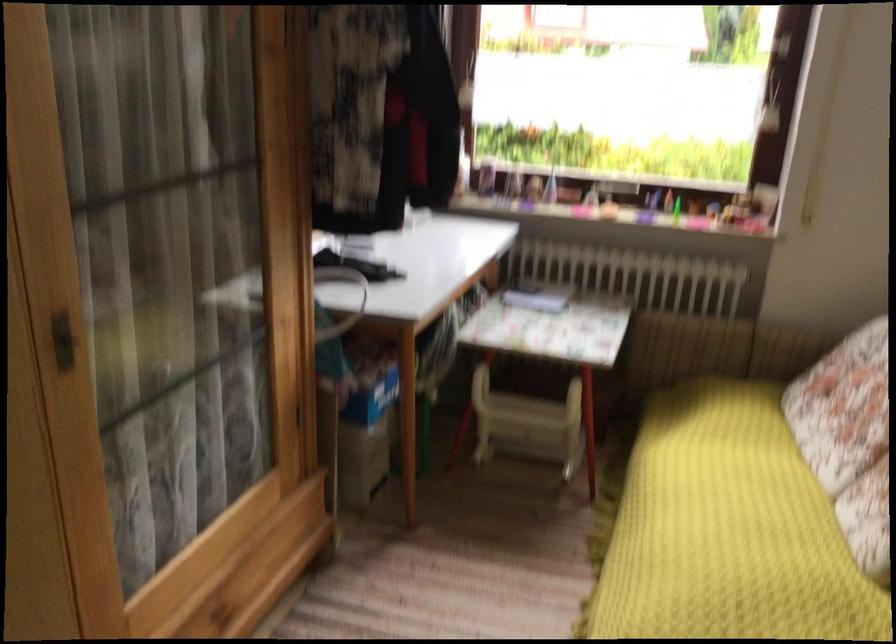
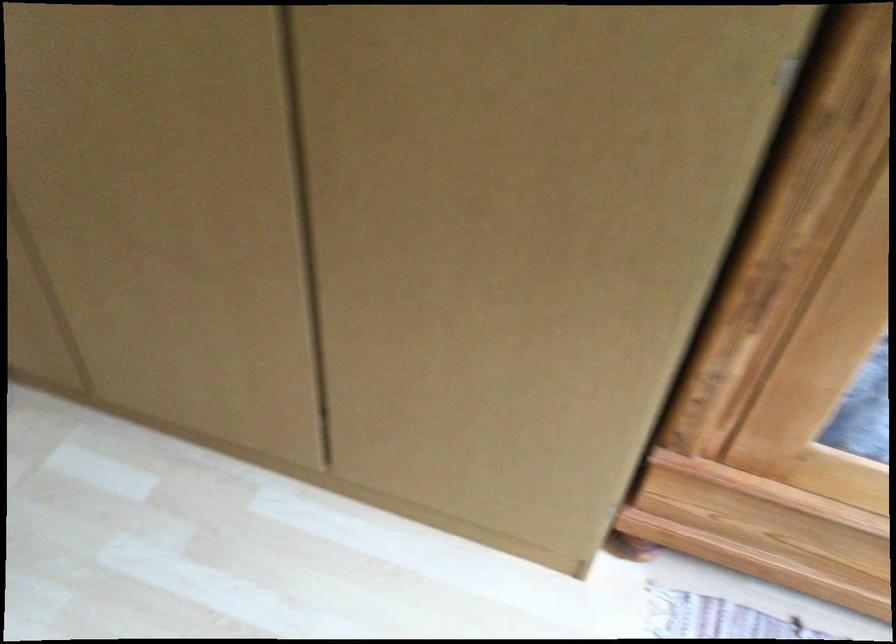
Based on the photo, the first image is from the beginning of the video and the second image is from the end. How did the camera likely rotate when shooting the video?

The rotation direction of the camera is left-down.